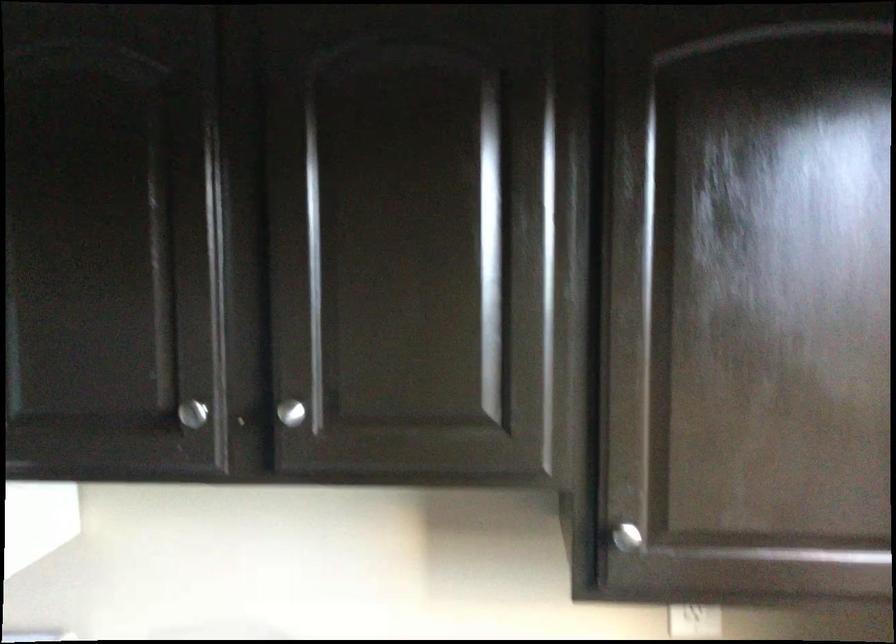
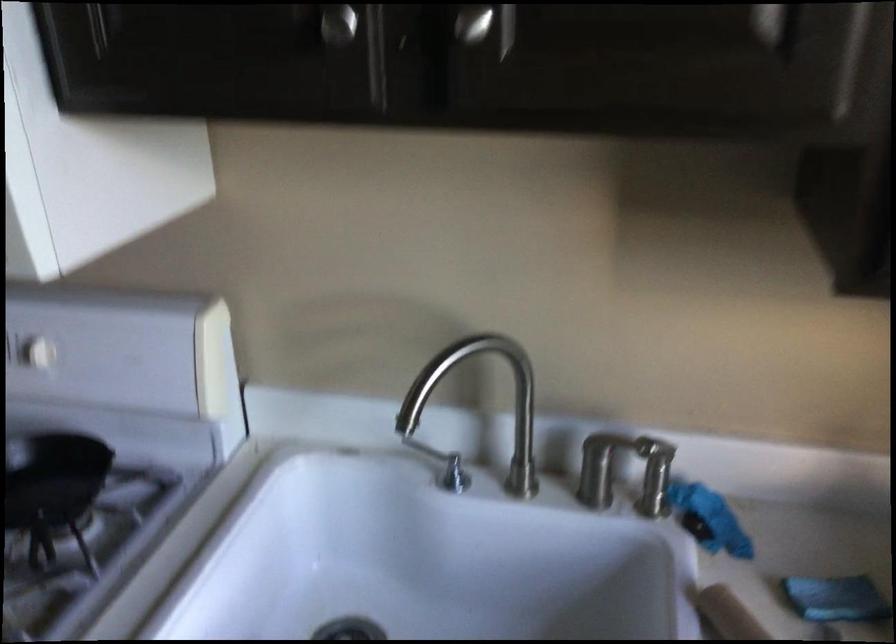
Which direction would the cameraman need to move to produce the second image?

The cameraman walked toward left, forward.